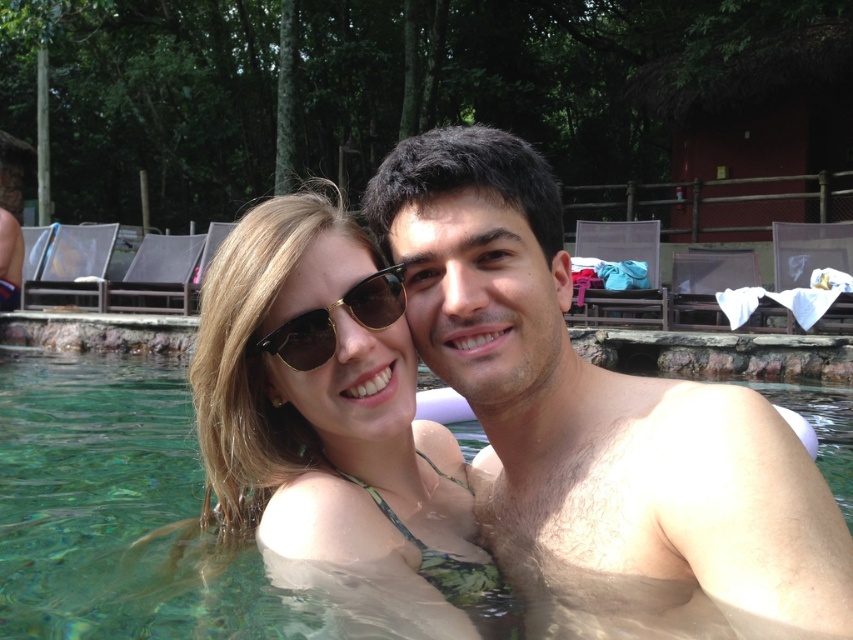
Is point (456, 339) less distant than point (262, 294)?

No, it is behind (262, 294).

Can you confirm if smooth skin man at center is positioned above matte green bikini top at center?

No.

This screenshot has width=853, height=640. Describe the element at coordinates (596, 400) in the screenshot. I see `smooth skin man at center` at that location.

The width and height of the screenshot is (853, 640). In order to click on smooth skin man at center in this screenshot , I will do pyautogui.click(x=596, y=400).

Which of these two, clear glass water at center or sunglasses at center, stands shorter?

clear glass water at center

Who is positioned more to the left, clear glass water at center or sunglasses at center?

clear glass water at center

Does point (341, 632) come in front of point (300, 330)?

That is True.

At what (x,y) coordinates should I click in order to perform the action: click on clear glass water at center. Please return your answer as a coordinate pair (x, y). Looking at the image, I should click on (123, 515).

Is clear glass water at center above hairless skin at center?

Incorrect, clear glass water at center is not positioned above hairless skin at center.

Can you confirm if clear glass water at center is positioned below hairless skin at center?

Indeed, clear glass water at center is positioned under hairless skin at center.

Does point (28, 605) lie behind point (825, 572)?

Yes, it is.

Locate an element on the screen. The image size is (853, 640). clear glass water at center is located at coordinates (123, 515).